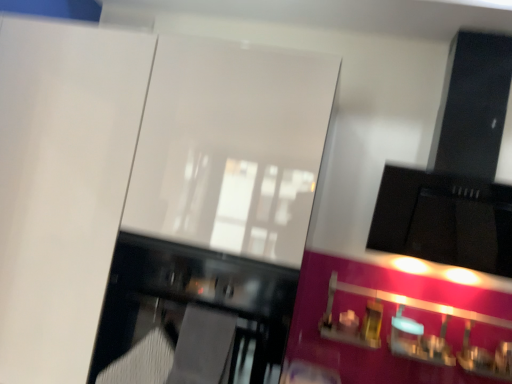
Question: From a real-world perspective, is pink glossy cabinet at lower right positioned above or below glossy black oven at lower left?

Choices:
 (A) above
 (B) below

Answer: (A)

Question: Is pink glossy cabinet at lower right in front of or behind glossy black oven at lower left in the image?

Choices:
 (A) behind
 (B) front

Answer: (A)

Question: From the image's perspective, relative to glossy black oven at lower left, is pink glossy cabinet at lower right above or below?

Choices:
 (A) above
 (B) below

Answer: (B)

Question: Considering the positions of point pyautogui.click(x=281, y=278) and point pyautogui.click(x=504, y=319), is point pyautogui.click(x=281, y=278) closer or farther from the camera than point pyautogui.click(x=504, y=319)?

Choices:
 (A) closer
 (B) farther

Answer: (A)

Question: Is glossy black oven at lower left inside the boundaries of pink glossy cabinet at lower right, or outside?

Choices:
 (A) outside
 (B) inside

Answer: (A)

Question: Looking at their shapes, would you say glossy black oven at lower left is wider or thinner than pink glossy cabinet at lower right?

Choices:
 (A) wide
 (B) thin

Answer: (A)

Question: From the image's perspective, is glossy black oven at lower left above or below pink glossy cabinet at lower right?

Choices:
 (A) above
 (B) below

Answer: (A)